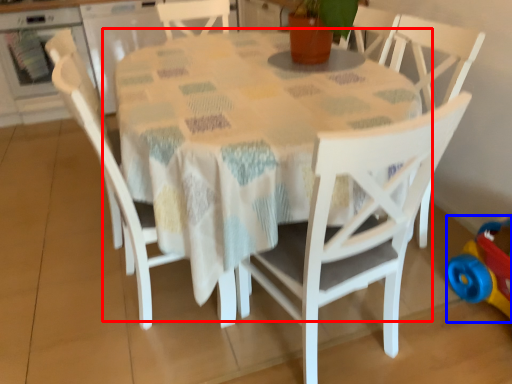
Question: Which of the following is the closest to the observer, table (highlighted by a red box) or toy (highlighted by a blue box)?

Choices:
 (A) table
 (B) toy

Answer: (A)